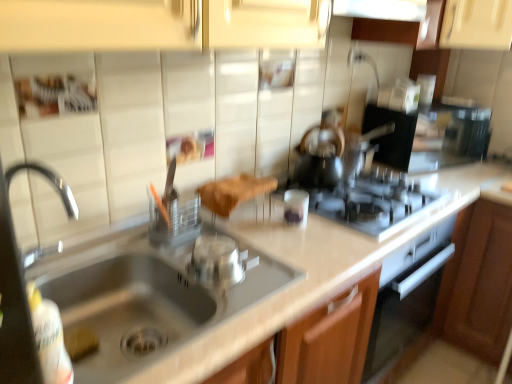
What are the coordinates of `free space to the left of transparent glass candle at center, which ranks as the 2th appliance in bottom-to-top order` in the screenshot? It's located at (242, 223).